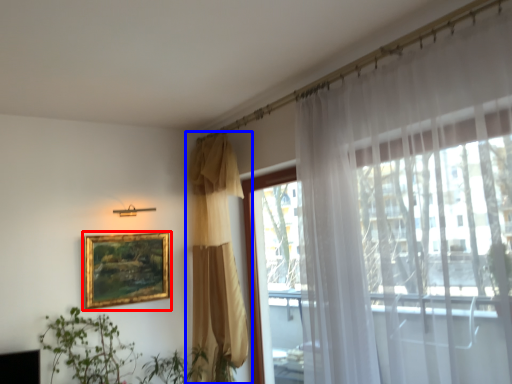
Question: Which object is further to the camera taking this photo, picture frame (highlighted by a red box) or curtain (highlighted by a blue box)?

Choices:
 (A) picture frame
 (B) curtain

Answer: (A)